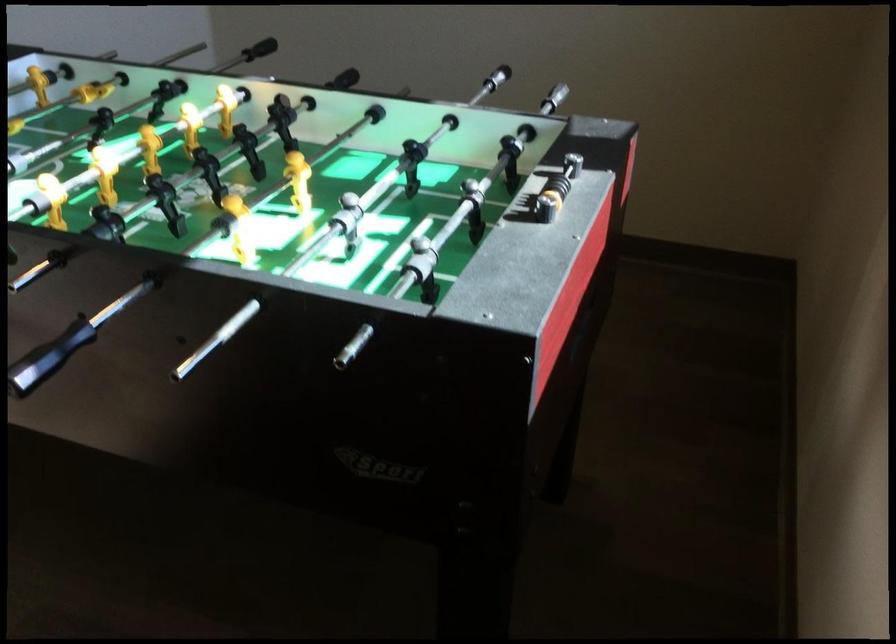
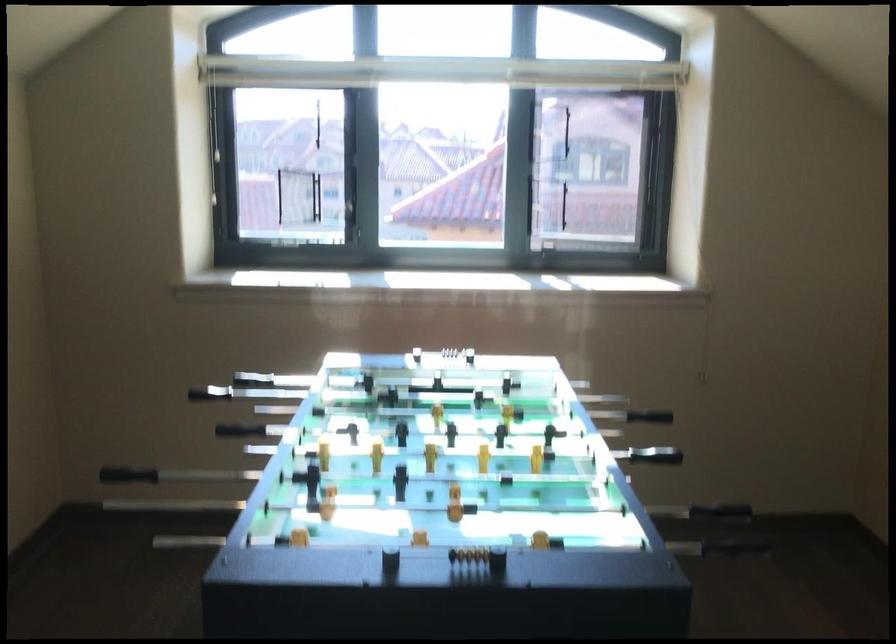
Find the pixel in the second image that matches (x=48, y=357) in the first image.

(645, 424)